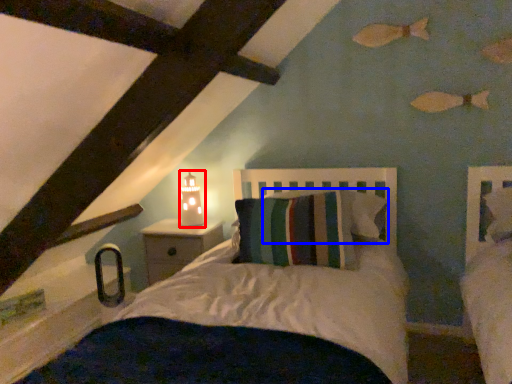
Question: Which of the following is the farthest to the observer, table lamp (highlighted by a red box) or pillow (highlighted by a blue box)?

Choices:
 (A) table lamp
 (B) pillow

Answer: (A)